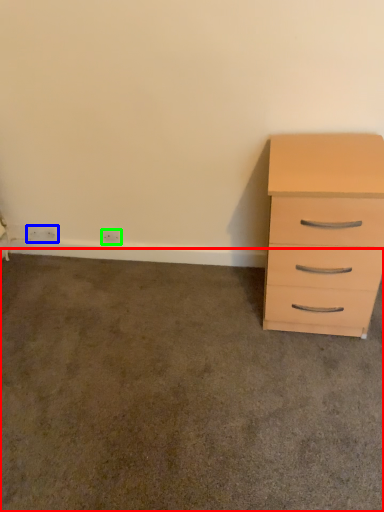
Question: Considering the real-world distances, which object is farthest from concrete (highlighted by a red box)? electric outlet (highlighted by a blue box) or electric outlet (highlighted by a green box)?

Choices:
 (A) electric outlet
 (B) electric outlet

Answer: (A)